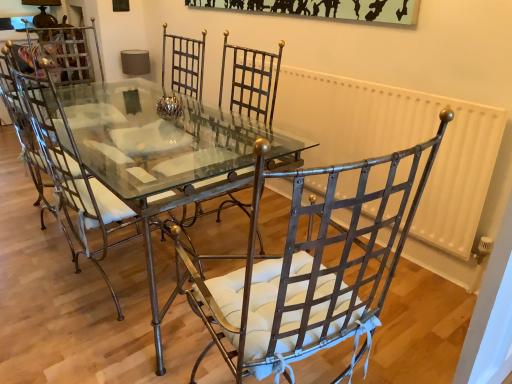
Question: From a real-world perspective, is white painted metal radiator at right positioned over matte metal chair at center, acting as the 1th chair starting from the left, based on gravity?

Choices:
 (A) no
 (B) yes

Answer: (A)

Question: Considering the relative sizes of white painted metal radiator at right and matte metal chair at center, acting as the 1th chair starting from the left, in the image provided, is white painted metal radiator at right wider than matte metal chair at center, acting as the 1th chair starting from the left,?

Choices:
 (A) yes
 (B) no

Answer: (B)

Question: Can you confirm if white painted metal radiator at right is positioned to the right of matte metal chair at center, which is counted as the second chair, starting from the right?

Choices:
 (A) no
 (B) yes

Answer: (B)

Question: Is white painted metal radiator at right not inside matte metal chair at center, acting as the 1th chair starting from the left?

Choices:
 (A) no
 (B) yes

Answer: (B)

Question: From a real-world perspective, is white painted metal radiator at right under matte metal chair at center, which is counted as the second chair, starting from the right?

Choices:
 (A) yes
 (B) no

Answer: (A)

Question: Is white painted metal radiator at right facing towards matte metal chair at center, acting as the 1th chair starting from the left?

Choices:
 (A) yes
 (B) no

Answer: (A)

Question: Can you confirm if metallic woven chair at center, which is counted as the 1th chair, starting from the right, is positioned to the left of matte metal chair at center, acting as the 1th chair starting from the left?

Choices:
 (A) no
 (B) yes

Answer: (A)

Question: From a real-world perspective, is metallic woven chair at center, which is counted as the 1th chair, starting from the right, on top of matte metal chair at center, acting as the 1th chair starting from the left?

Choices:
 (A) yes
 (B) no

Answer: (B)

Question: Does metallic woven chair at center, placed as the 2th chair when sorted from left to right, have a lesser height compared to matte metal chair at center, which is counted as the second chair, starting from the right?

Choices:
 (A) yes
 (B) no

Answer: (B)

Question: Is matte metal chair at center, which is counted as the second chair, starting from the right, completely or partially inside metallic woven chair at center, placed as the 2th chair when sorted from left to right?

Choices:
 (A) yes
 (B) no

Answer: (B)

Question: Does metallic woven chair at center, which is counted as the 1th chair, starting from the right, have a lesser width compared to matte metal chair at center, acting as the 1th chair starting from the left?

Choices:
 (A) yes
 (B) no

Answer: (A)

Question: From a real-world perspective, is metallic woven chair at center, which is counted as the 1th chair, starting from the right, positioned under matte metal chair at center, acting as the 1th chair starting from the left, based on gravity?

Choices:
 (A) no
 (B) yes

Answer: (B)

Question: From a real-world perspective, is matte metal chair at center, acting as the 1th chair starting from the left, physically below metallic glass table at center?

Choices:
 (A) no
 (B) yes

Answer: (A)